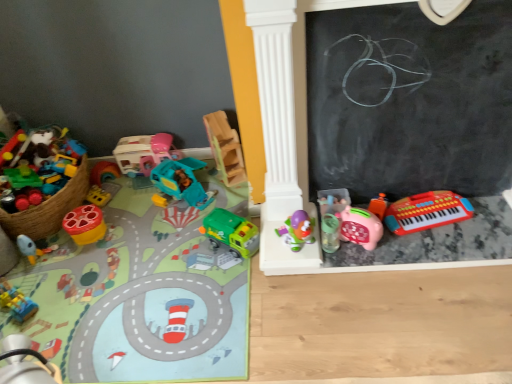
Locate an element on the screen. This screenshot has width=512, height=384. vacant area that lies between teal plastic car at center, marked as the 7th toy in a right-to-left arrangement, and matte plastic toy rocket at lower left, which is the 12th toy from right to left is located at coordinates (121, 223).